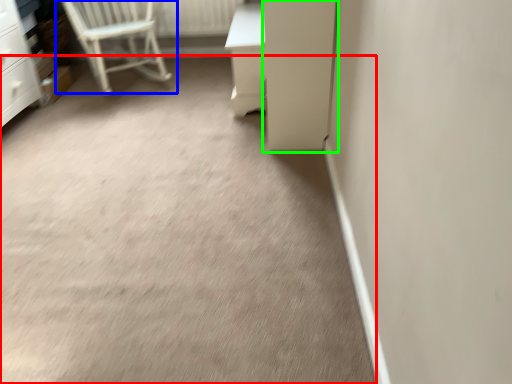
Question: Which object is positioned closest to concrete (highlighted by a red box)? Select from chair (highlighted by a blue box) and screen door (highlighted by a green box).

Choices:
 (A) chair
 (B) screen door

Answer: (B)